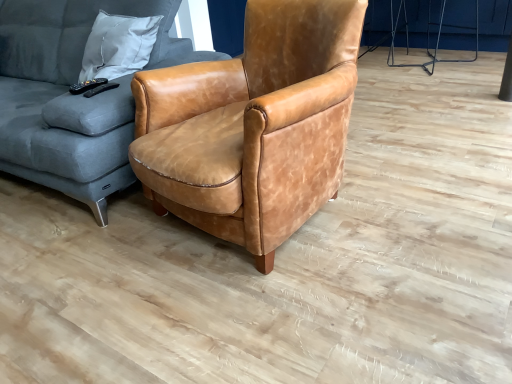
In order to click on free space to the right of matte brown leather armchair at center in this screenshot , I will do `click(422, 186)`.